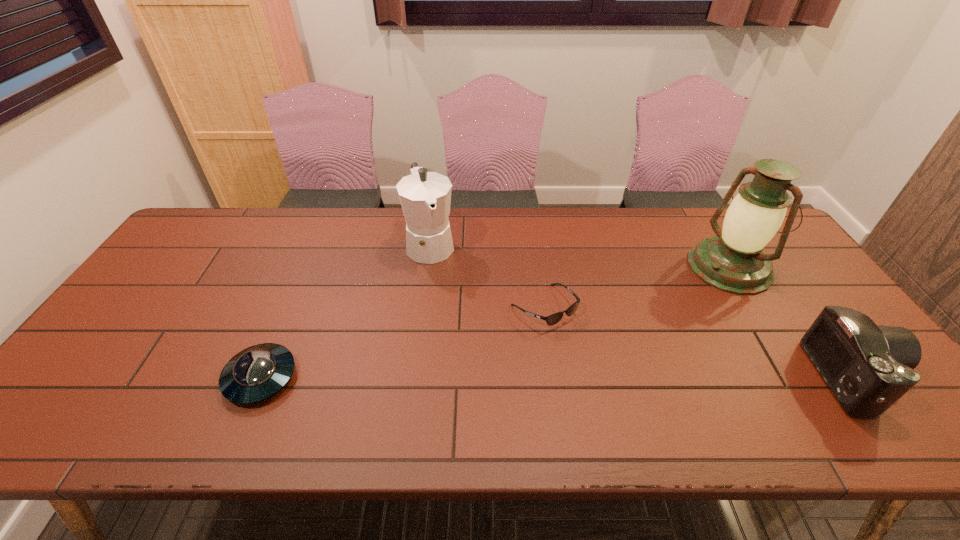
At what (x,y) coordinates should I click in order to perform the action: click on saucer. Please return your answer as a coordinate pair (x, y). The height and width of the screenshot is (540, 960). Looking at the image, I should click on (258, 372).

At what (x,y) coordinates should I click in order to perform the action: click on camera. Please return your answer as a coordinate pair (x, y). The height and width of the screenshot is (540, 960). Looking at the image, I should click on (868, 367).

Where is `sunglasses`? The width and height of the screenshot is (960, 540). sunglasses is located at coordinates (553, 319).

Where is `coffeepot`? coffeepot is located at coordinates (425, 197).

Identify the location of the fourth shortest object. The image size is (960, 540). (425, 197).

Locate an element on the screen. the tallest object is located at coordinates (733, 261).

Where is `vacant space located 0.380m on the back of the leftmost object`? The image size is (960, 540). vacant space located 0.380m on the back of the leftmost object is located at coordinates (314, 252).

I want to click on blank area located 0.120m on the front-facing side of the third object from left to right, so click(598, 359).

I want to click on blank space located 0.050m on the front-facing side of the third object from left to right, so click(579, 340).

Where is `blank area located on the front-facing side of the third object from left to right`? blank area located on the front-facing side of the third object from left to right is located at coordinates (642, 401).